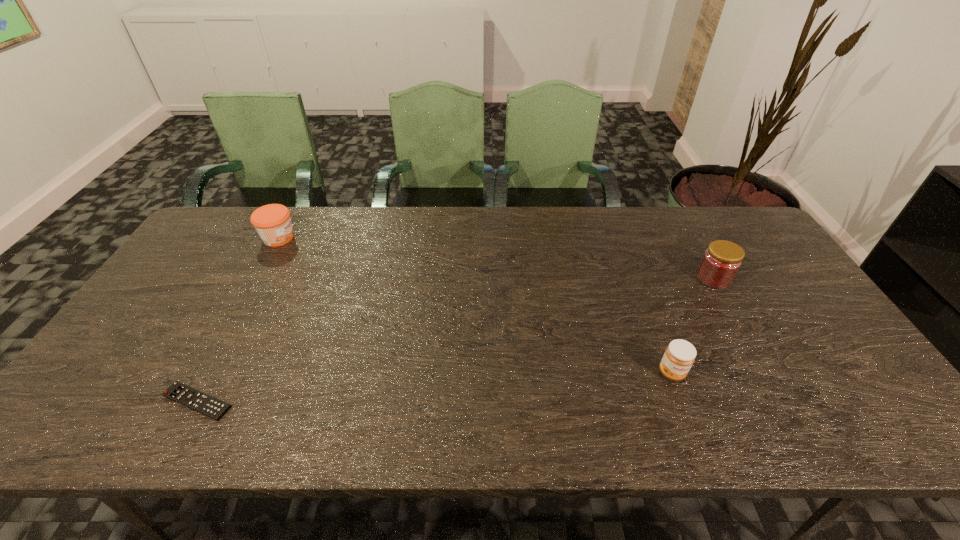
What are the coordinates of `vacant space in between the second object from right to left and the leftmost jam` in the screenshot? It's located at (475, 305).

This screenshot has height=540, width=960. I want to click on empty location between the second object from right to left and the rightmost jam, so click(x=692, y=326).

Identify the location of vacant area that lies between the rightmost jam and the remote control. The height and width of the screenshot is (540, 960). (455, 340).

At what (x,y) coordinates should I click in order to perform the action: click on free space that is in between the farthest object and the remote control. Please return your answer as a coordinate pair (x, y). The image size is (960, 540). Looking at the image, I should click on pyautogui.click(x=238, y=320).

At what (x,y) coordinates should I click in order to perform the action: click on empty space that is in between the leftmost jam and the remote control. Please return your answer as a coordinate pair (x, y). Looking at the image, I should click on (x=238, y=320).

Where is `the second closest object to the farthest object`? the second closest object to the farthest object is located at coordinates (679, 356).

This screenshot has height=540, width=960. What are the coordinates of `object identified as the second closest to the second jam from right to left` in the screenshot? It's located at coord(185,395).

You are a GUI agent. You are given a task and a screenshot of the screen. Output one action in this format:
    pyautogui.click(x=<x>, y=<y>)
    Task: Click on the jam that is the closest to the remote control
    This screenshot has width=960, height=540.
    Given the screenshot: What is the action you would take?
    pyautogui.click(x=272, y=222)

At what (x,y) coordinates should I click in order to perform the action: click on the closest jam to the second jam from left to right. Please return your answer as a coordinate pair (x, y). Looking at the image, I should click on (722, 260).

You are a GUI agent. You are given a task and a screenshot of the screen. Output one action in this format:
    pyautogui.click(x=<x>, y=<y>)
    Task: Click on the vacant area in the image that satisfies the following two spatial constraints: 1. on the front label of the leftmost jam; 2. on the right side of the shortest object
    The width and height of the screenshot is (960, 540).
    Given the screenshot: What is the action you would take?
    pyautogui.click(x=190, y=401)